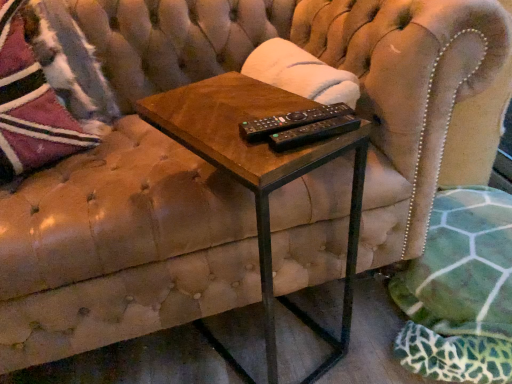
Where is `vacant space that is to the left of black plastic remote at center`? vacant space that is to the left of black plastic remote at center is located at coordinates (229, 135).